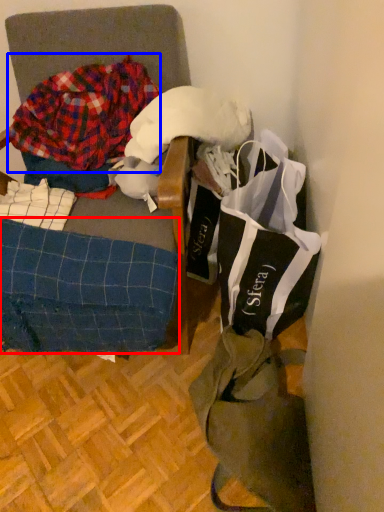
Question: Which of the following is the closest to the observer, underclothes (highlighted by a red box) or flannel (highlighted by a blue box)?

Choices:
 (A) underclothes
 (B) flannel

Answer: (A)